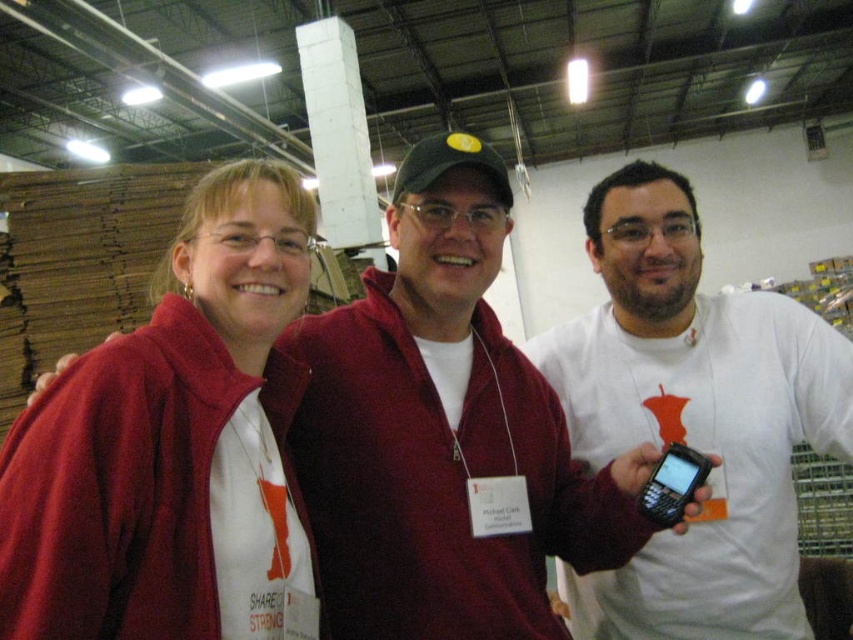
You are organizing a clothing donation drive and need to determine which items can fit into a narrow storage box. You have a matte red jacket at center and a white matte shirt at center. Based on their thickness, which one is more likely to fit into the narrow box?

The matte red jacket at center is thinner than the white matte shirt at center, so it is more likely to fit into the narrow storage box.

You are attending a conference and need to locate the person wearing the white matte shirt at center. From your perspective facing the group, which direction should you look relative to the matte red jacket at center?

The white matte shirt at center is to the right of the matte red jacket at center, so you should look to the right of the matte red jacket at center to find the person wearing the white matte shirt at center.